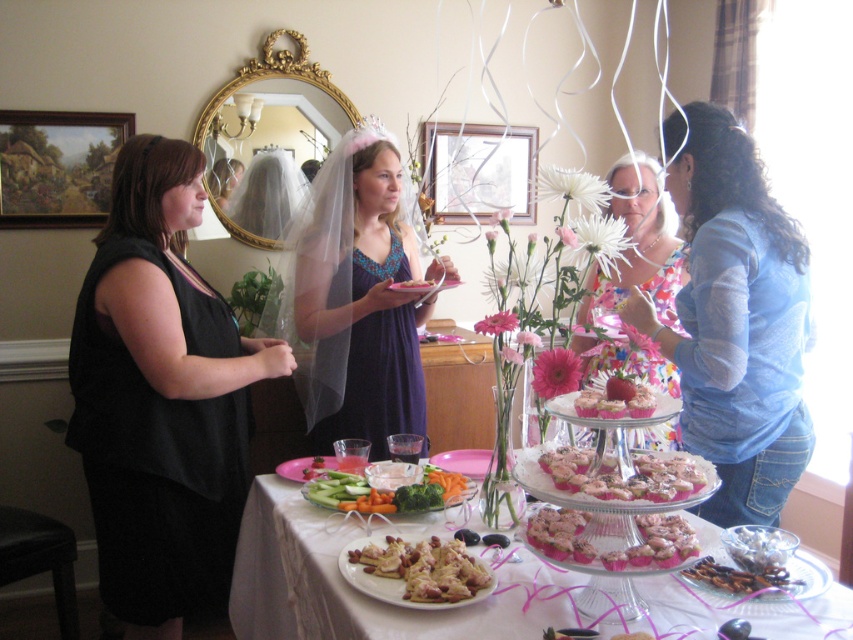
Consider the image. Who is shorter, chocolate-covered nuts at lower right or matte plastic cupcake at center?

Standing shorter between the two is chocolate-covered nuts at lower right.

Does chocolate-covered nuts at lower right have a greater width compared to matte plastic cupcake at center?

Yes.

Who is more distant from viewer, (688, 568) or (399, 289)?

The point (399, 289) is behind.

This screenshot has width=853, height=640. I want to click on chocolate-covered nuts at lower right, so click(740, 577).

Can you confirm if white frosted cake at center is shorter than white crumbly pastry at center?

No, white frosted cake at center is not shorter than white crumbly pastry at center.

Who is more forward, (318, 525) or (474, 561)?

Point (474, 561) is more forward.

Find the location of a particular element. Image resolution: width=853 pixels, height=640 pixels. white frosted cake at center is located at coordinates (343, 582).

Who is shorter, pink matte cupcakes at center or matte plastic cupcake at center?

matte plastic cupcake at center

Is pink matte cupcakes at center behind matte plastic cupcake at center?

No, pink matte cupcakes at center is in front of matte plastic cupcake at center.

The width and height of the screenshot is (853, 640). Describe the element at coordinates (611, 548) in the screenshot. I see `pink matte cupcakes at center` at that location.

In order to click on pink matte cupcakes at center in this screenshot , I will do `click(611, 548)`.